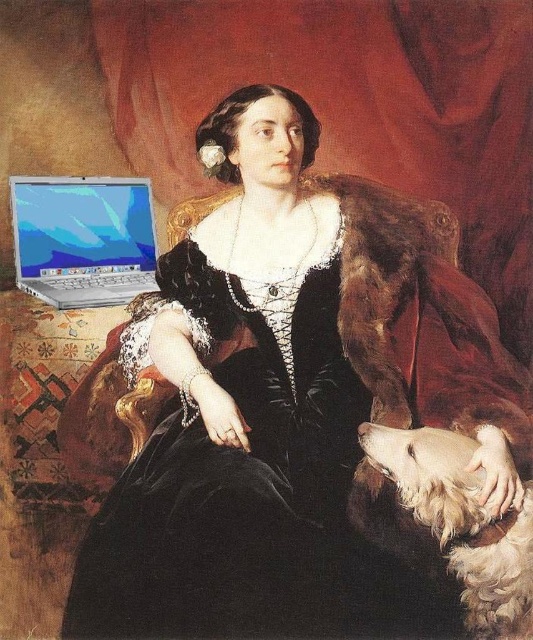
Question: Is black velvet dress at center positioned before white fluffy dog at lower right?

Choices:
 (A) yes
 (B) no

Answer: (B)

Question: Which is nearer to the silver metallic laptop at lower left?

Choices:
 (A) black velvet dress at center
 (B) white fluffy dog at lower right

Answer: (A)

Question: Does white fluffy dog at lower right appear under silver metallic laptop at lower left?

Choices:
 (A) yes
 (B) no

Answer: (A)

Question: Which point is farther to the camera?

Choices:
 (A) (369, 403)
 (B) (494, 561)

Answer: (A)

Question: Is black velvet dress at center in front of silver metallic laptop at lower left?

Choices:
 (A) no
 (B) yes

Answer: (B)

Question: Which object is farther from the camera taking this photo?

Choices:
 (A) silver metallic laptop at lower left
 (B) black velvet dress at center

Answer: (A)